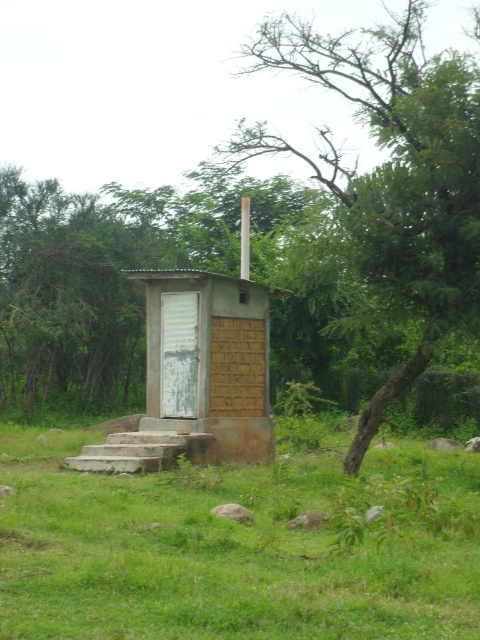
Does brown concrete outhouse at center have a larger size compared to green leafy tree at center?

Actually, brown concrete outhouse at center might be smaller than green leafy tree at center.

Which is behind, point (63, 577) or point (376, 60)?

The point (376, 60) is more distant.

Is point (126, 605) positioned after point (474, 88)?

No, (126, 605) is closer to viewer.

In order to click on brown concrete outhouse at center in this screenshot , I will do `click(236, 547)`.

At what (x,y) coordinates should I click in order to perform the action: click on green leafy tree at center. Please return your answer as a coordinate pair (x, y). Looking at the image, I should click on click(x=392, y=173).

Between point (383, 180) and point (168, 312), which one is positioned behind?

Point (168, 312)

Between point (360, 454) and point (262, 456), which one is positioned behind?

Point (262, 456)

Find the location of a particular element. This screenshot has height=640, width=480. green leafy tree at center is located at coordinates (392, 173).

Between brown concrete outhouse at center and brown corrugated metal hut at center, which one appears on the left side from the viewer's perspective?

brown corrugated metal hut at center

What do you see at coordinates (236, 547) in the screenshot? I see `brown concrete outhouse at center` at bounding box center [236, 547].

Locate an element on the screen. brown concrete outhouse at center is located at coordinates (236, 547).